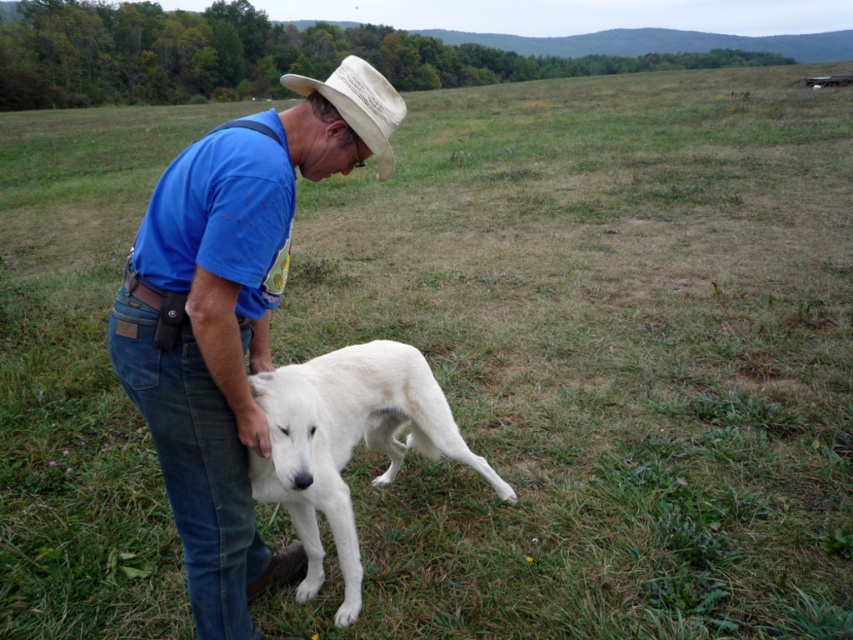
You are a fashion designer observing the man in the image. You need to create a new outfit for him that accommodates his current belt and utility pouch. Considering the blue cotton shirt at center and the white fur dog at lower left, which item is narrower so that the belt can be easily adjusted around it?

The blue cotton shirt at center is narrower than the white fur dog at lower left, so the belt can be easily adjusted around the blue cotton shirt at center.